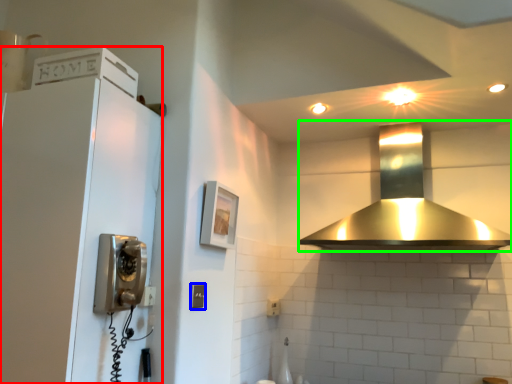
Question: Which object is positioned closest to appliance (highlighted by a red box)? Select from light switch (highlighted by a blue box) and home appliance (highlighted by a green box).

Choices:
 (A) light switch
 (B) home appliance

Answer: (A)